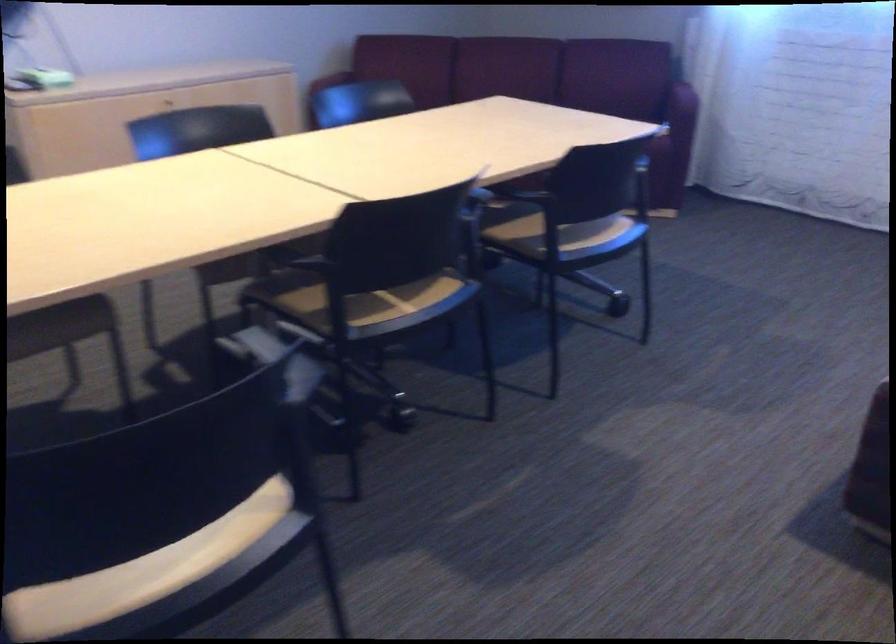
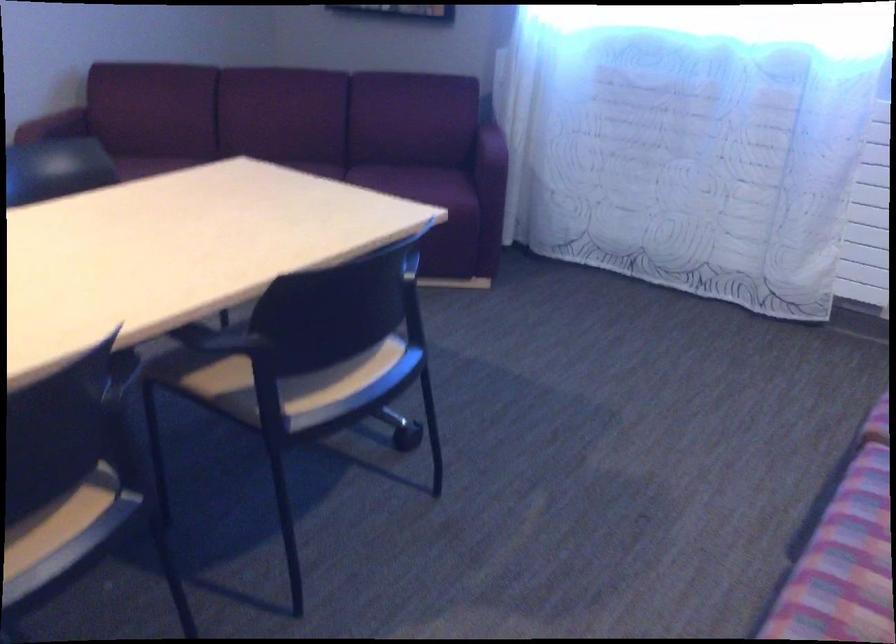
Question: How did the camera likely rotate?

Choices:
 (A) Left
 (B) Right
 (C) Up
 (D) Down

Answer: (B)